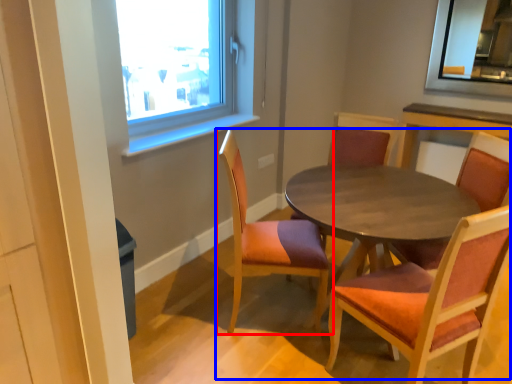
Question: Which object is further to the camera taking this photo, chair (highlighted by a red box) or kitchen & dining room table (highlighted by a blue box)?

Choices:
 (A) chair
 (B) kitchen & dining room table

Answer: (A)